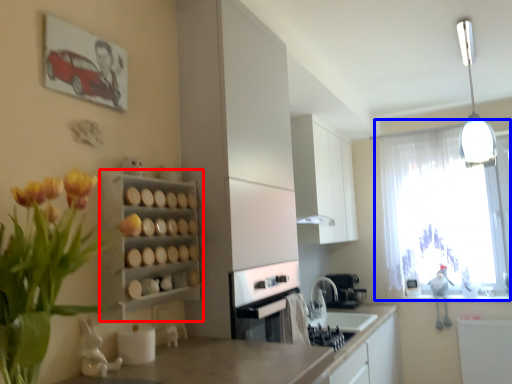
Question: Among these objects, which one is farthest to the camera, shelf (highlighted by a red box) or window (highlighted by a blue box)?

Choices:
 (A) shelf
 (B) window

Answer: (B)